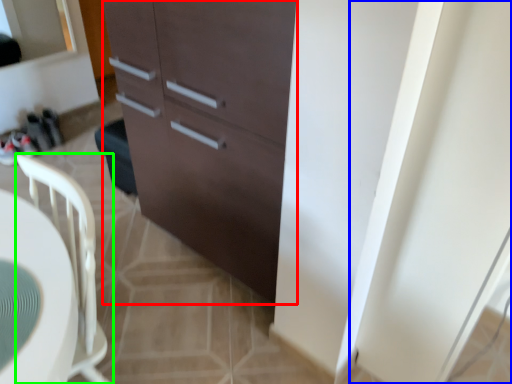
Question: Estimate the real-world distances between objects in this image. Which object is farther from cabinetry (highlighted by a red box), screen door (highlighted by a blue box) or chair (highlighted by a green box)?

Choices:
 (A) screen door
 (B) chair

Answer: (A)